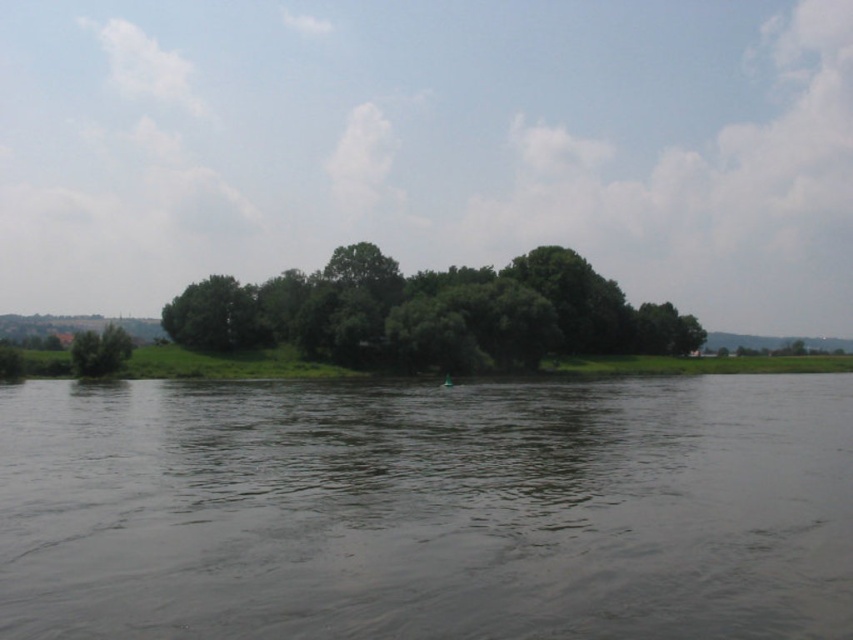
You are standing at the edge of the river and notice the brown murky water at center. If you want to avoid stepping into it, which direction should you move?

To avoid stepping into the brown murky water at center, you should move away from the point at coordinates (427, 509). Since the water is at the center, moving towards the edges of the river would keep you away from it.

You are a kayaker approaching the brown murky water at center and the green leafy tree at left. Which object is located beneath the other?

The brown murky water at center is positioned under the green leafy tree at left.

You are standing at the riverside and want to take a photo of the green leafy trees at center. If your camera has a maximum focusing distance of 100 meters, will you be able to focus on the trees?

The green leafy trees at center are 89.71 meters away from the camera. Since this distance is less than the maximum focusing distance of 100 meters, the camera should be able to focus on the trees.